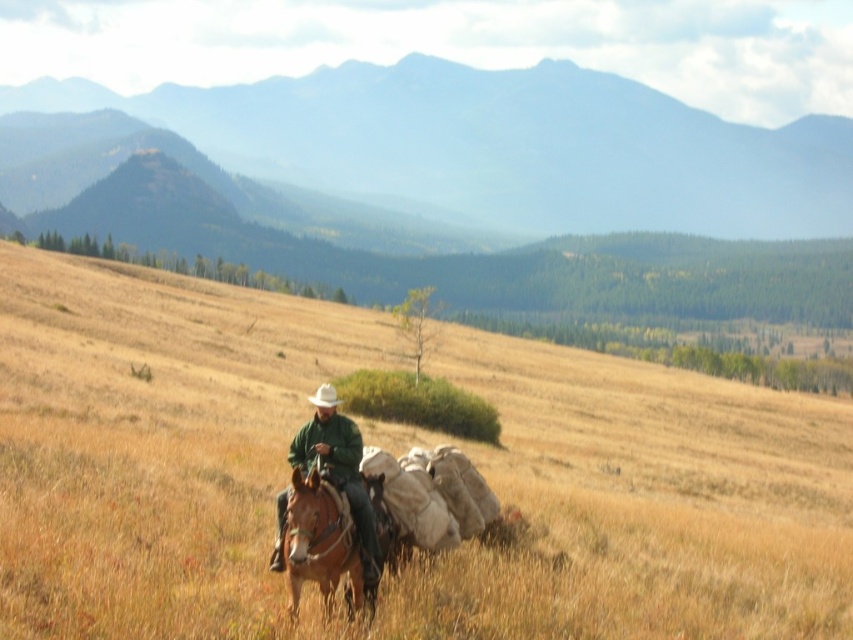
Find the location of a particular element. This screenshot has height=640, width=853. brown leather horse at center is located at coordinates (322, 545).

Is brown leather horse at center smaller than green matte jacket at center?

Correct, brown leather horse at center occupies less space than green matte jacket at center.

Which is behind, point (308, 502) or point (299, 467)?

The point (299, 467) is more distant.

Locate an element on the screen. The width and height of the screenshot is (853, 640). brown leather horse at center is located at coordinates (322, 545).

Is point (149, 621) positioned after point (273, 566)?

No, (149, 621) is closer to viewer.

What do you see at coordinates (149, 444) in the screenshot? I see `dry grass at center` at bounding box center [149, 444].

Locate an element on the screen. This screenshot has width=853, height=640. dry grass at center is located at coordinates (149, 444).

Which is in front, point (651, 593) or point (322, 484)?

Positioned in front is point (322, 484).

Is point (631, 522) behind point (370, 596)?

That is True.

You are a GUI agent. You are given a task and a screenshot of the screen. Output one action in this format:
    pyautogui.click(x=<x>, y=<y>)
    Task: Click on the dry grass at center
    This screenshot has width=853, height=640.
    Given the screenshot: What is the action you would take?
    pyautogui.click(x=149, y=444)